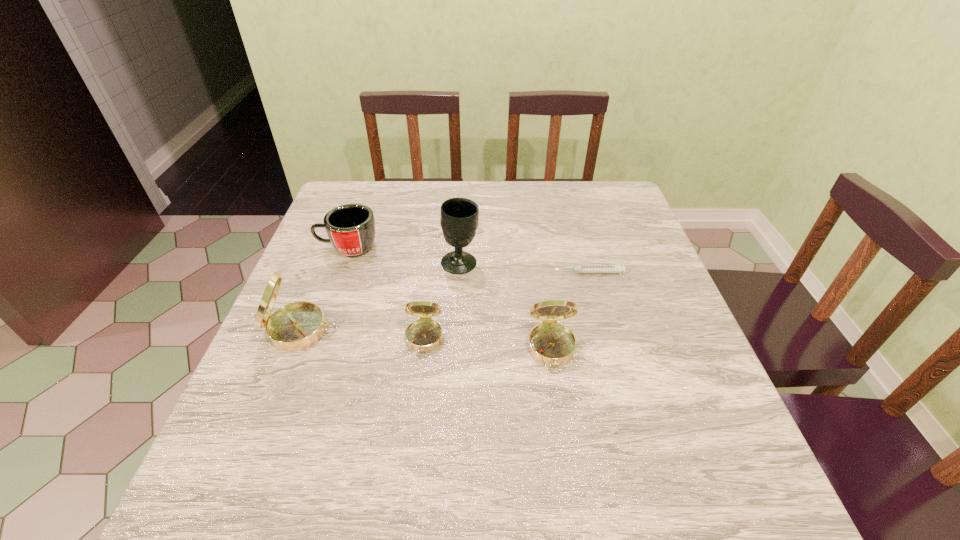
Image resolution: width=960 pixels, height=540 pixels. In order to click on vacant space situated on the front of the chalice in this screenshot , I will do `click(454, 380)`.

Locate an element on the screen. The image size is (960, 540). free space located 0.180m at the needle end of the syringe is located at coordinates (482, 273).

At what (x,y) coordinates should I click in order to perform the action: click on free space located 0.180m at the needle end of the syringe. Please return your answer as a coordinate pair (x, y). The height and width of the screenshot is (540, 960). Looking at the image, I should click on (482, 273).

Identify the location of free space located at the needle end of the syringe. The width and height of the screenshot is (960, 540). (446, 273).

Locate an element on the screen. The image size is (960, 540). compass positioned at the left edge is located at coordinates coord(296,326).

You are a GUI agent. You are given a task and a screenshot of the screen. Output one action in this format:
    pyautogui.click(x=<x>, y=<y>)
    Task: Click on the mug situated at the left edge
    
    Given the screenshot: What is the action you would take?
    pyautogui.click(x=351, y=229)

Where is `object that is positioned at the right edge`? object that is positioned at the right edge is located at coordinates (580, 268).

The image size is (960, 540). In the image, there is a desktop. Identify the location of vacant space at the far edge. (392, 193).

Identify the location of free space at the near edge of the desktop. The image size is (960, 540). (508, 415).

At what (x,y) coordinates should I click in order to perform the action: click on vacant point at the left edge. Please return your answer as a coordinate pair (x, y). Looking at the image, I should click on (338, 291).